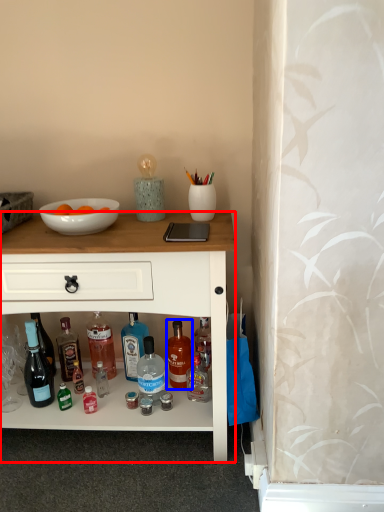
Question: Among these objects, which one is nearest to the camera, desk (highlighted by a red box) or bottle (highlighted by a blue box)?

Choices:
 (A) desk
 (B) bottle

Answer: (A)